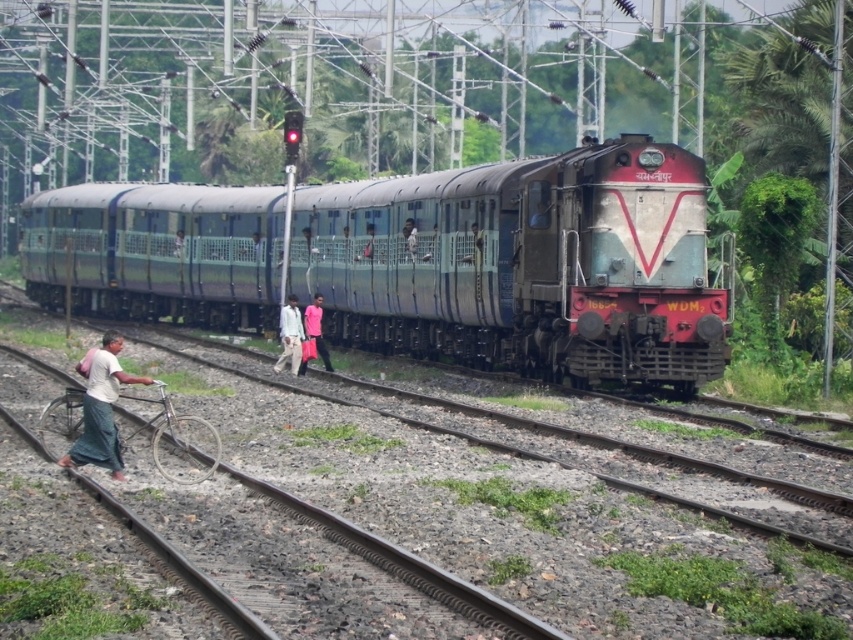
Between green metallic train at center and light blue fabric pants at center, which one is positioned higher?

green metallic train at center is higher up.

Does green metallic train at center have a greater height compared to light blue fabric pants at center?

Yes.

Does point (479, 305) come behind point (480, 232)?

Yes.

At what (x,y) coordinates should I click in order to perform the action: click on green metallic train at center. Please return your answer as a coordinate pair (x, y). Looking at the image, I should click on (525, 266).

Does white fabric shirt at lower left have a larger size compared to light blue fabric pants at center?

Correct, white fabric shirt at lower left is larger in size than light blue fabric pants at center.

Is point (115, 381) behind point (477, 246)?

No, (115, 381) is closer to viewer.

This screenshot has height=640, width=853. I want to click on white fabric shirt at lower left, so click(102, 408).

I want to click on white fabric shirt at lower left, so click(x=102, y=408).

Measure the distance between pink fabric bag at center and camera.

79.38 feet

Can you confirm if pink fabric bag at center is taller than light blue fabric pants at center?

Indeed, pink fabric bag at center has a greater height compared to light blue fabric pants at center.

Between point (318, 333) and point (473, 244), which one is positioned behind?

Point (318, 333)

Find the location of `pink fabric bag at center`. pink fabric bag at center is located at coordinates (316, 328).